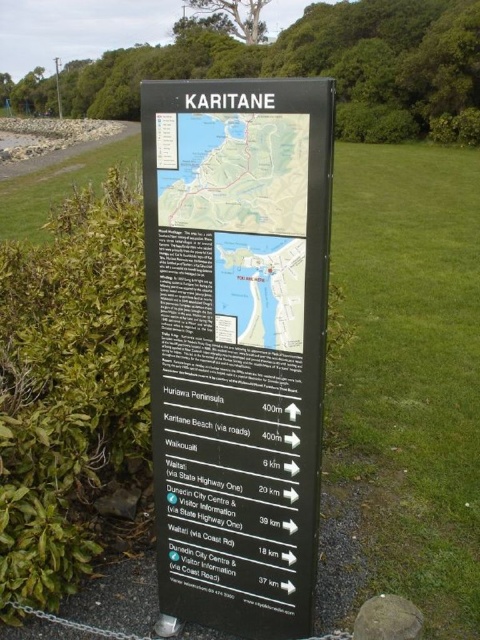
Question: Is black plastic sign at center below matte plastic map at center?

Choices:
 (A) yes
 (B) no

Answer: (A)

Question: Does black plastic sign at center appear on the right side of matte black map at center?

Choices:
 (A) no
 (B) yes

Answer: (A)

Question: Based on their relative distances, which object is farther from the matte plastic map at center?

Choices:
 (A) matte black map at center
 (B) black plastic sign at center

Answer: (A)

Question: Which object is the farthest from the matte black map at center?

Choices:
 (A) matte plastic map at center
 (B) black plastic sign at center

Answer: (A)

Question: Does matte plastic map at center have a larger size compared to matte black map at center?

Choices:
 (A) yes
 (B) no

Answer: (A)

Question: Based on their relative distances, which object is farther from the matte plastic map at center?

Choices:
 (A) black plastic sign at center
 (B) matte black map at center

Answer: (B)